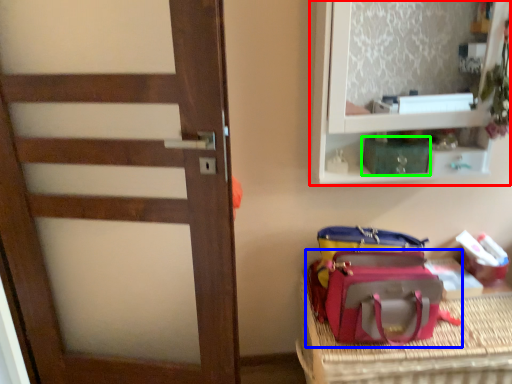
Question: Which object is positioned farthest from shelf (highlighted by a red box)? Select from luggage and bags (highlighted by a blue box) and kit (highlighted by a green box).

Choices:
 (A) luggage and bags
 (B) kit

Answer: (A)